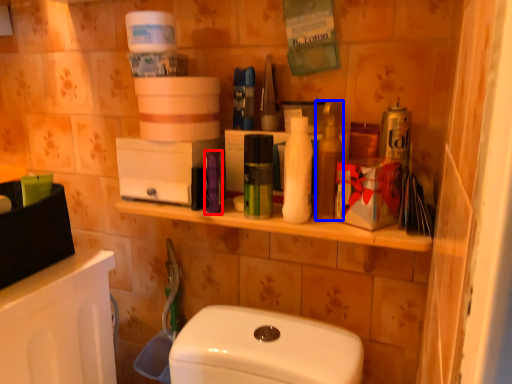
Question: Which object appears farthest to the camera in this image, toiletry (highlighted by a red box) or cleaning product (highlighted by a blue box)?

Choices:
 (A) toiletry
 (B) cleaning product

Answer: (A)